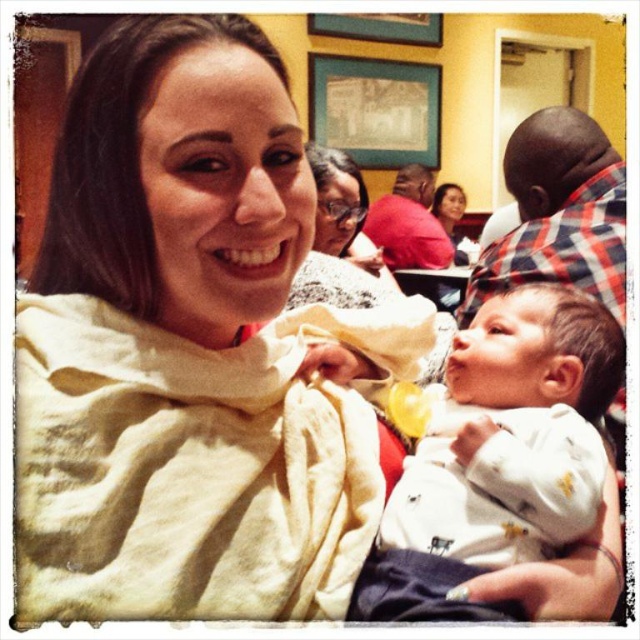
You are a photographer adjusting your camera to focus on two points in the scene. The first point is point (595, 376) and the second is point (618, 525). Which point is closer to your camera?

Point (595, 376) is closer to the camera than point (618, 525) because it is further to the viewer.

In the scene shown: You are a photographer trying to capture the baby in the white outfit. The baby is currently at point (180, 352). You want to move your camera 0.1 units to the right along the x axis. Will the baby still be in the frame?

The white soft scarf at center is located at point (180, 352). Moving the camera 0.1 units to the right along the x axis would shift the frame, but since the baby is being cradled by the woman and not moving, the baby would remain in the frame as the camera position change does not affect the baby location.

You are a photographer trying to capture a closeup of the white soft scarf at center and the white soft fabric baby at center. Which object should you zoom in on to ensure both are in focus without moving the camera?

The white soft scarf at center is wider than the white soft fabric baby at center, so you should zoom in on the white soft fabric baby at center to ensure both are in focus without moving the camera.